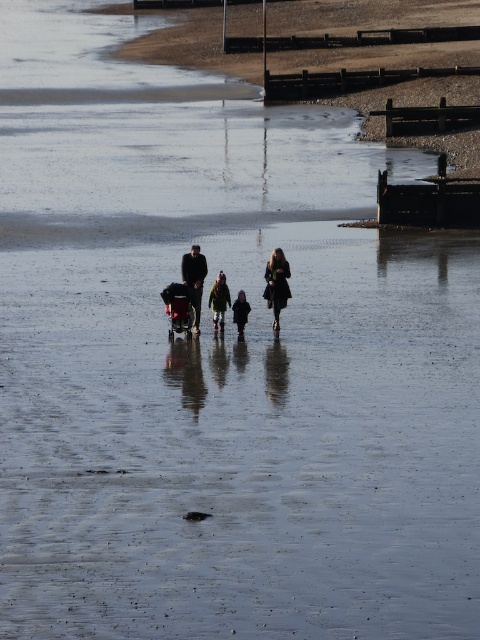
Question: Among these points, which one is nearest to the camera?

Choices:
 (A) (197, 333)
 (B) (167, 307)

Answer: (B)

Question: From the image, what is the correct spatial relationship of dark brown leather coat at center in relation to metallic silver baby carriage at center?

Choices:
 (A) right
 (B) left

Answer: (A)

Question: Which object appears closest to the camera in this image?

Choices:
 (A) dark fabric jacket at center
 (B) green fabric jacket at center
 (C) metallic silver baby carriage at center
 (D) dark blue coat at center

Answer: (C)

Question: Is dark brown leather coat at center in front of metallic silver baby carriage at center?

Choices:
 (A) no
 (B) yes

Answer: (A)

Question: Which object is closer to the camera taking this photo?

Choices:
 (A) metallic silver baby carriage at center
 (B) dark blue coat at center
 (C) dark fabric jacket at center
 (D) green fabric jacket at center

Answer: (A)

Question: Where is green fabric jacket at center located in relation to dark blue coat at center in the image?

Choices:
 (A) below
 (B) above

Answer: (B)